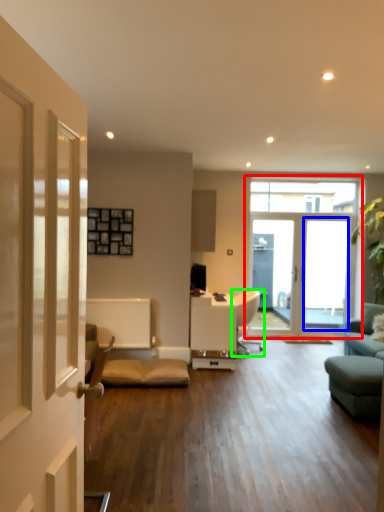
Question: Based on their relative distances, which object is farther from window (highlighted by a red box)? Choose from window screen (highlighted by a blue box) and chair (highlighted by a green box).

Choices:
 (A) window screen
 (B) chair

Answer: (B)